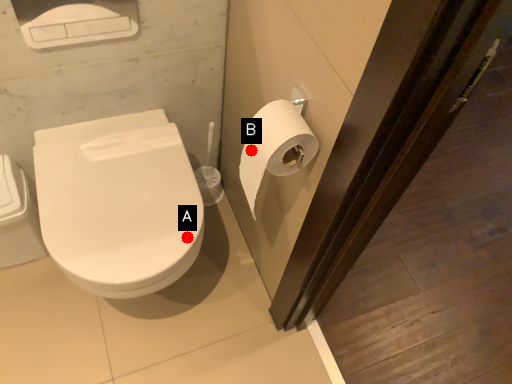
Question: Two points are circled on the image, labeled by A and B beside each circle. Which point is farther to the camera?

Choices:
 (A) A is further
 (B) B is further

Answer: (A)